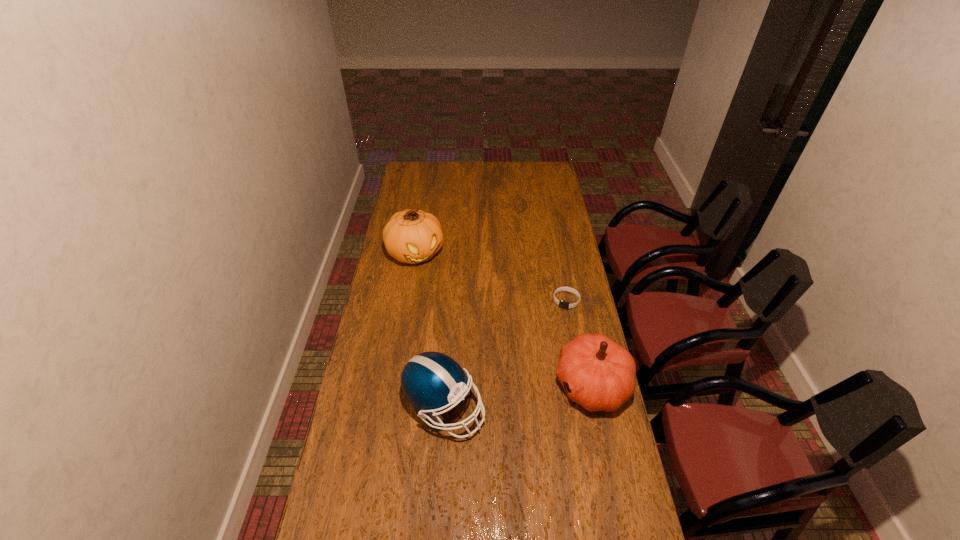
This screenshot has height=540, width=960. Identify the location of vacant spot on the desktop that is between the football helmet and the right pumpkin and is positioned on the outer surface of the wristband. (535, 393).

Where is `vacant space on the desktop that is between the football helmet and the nearer pumpkin and is positioned on the front face of the farther pumpkin`? The width and height of the screenshot is (960, 540). vacant space on the desktop that is between the football helmet and the nearer pumpkin and is positioned on the front face of the farther pumpkin is located at coordinates [x=519, y=396].